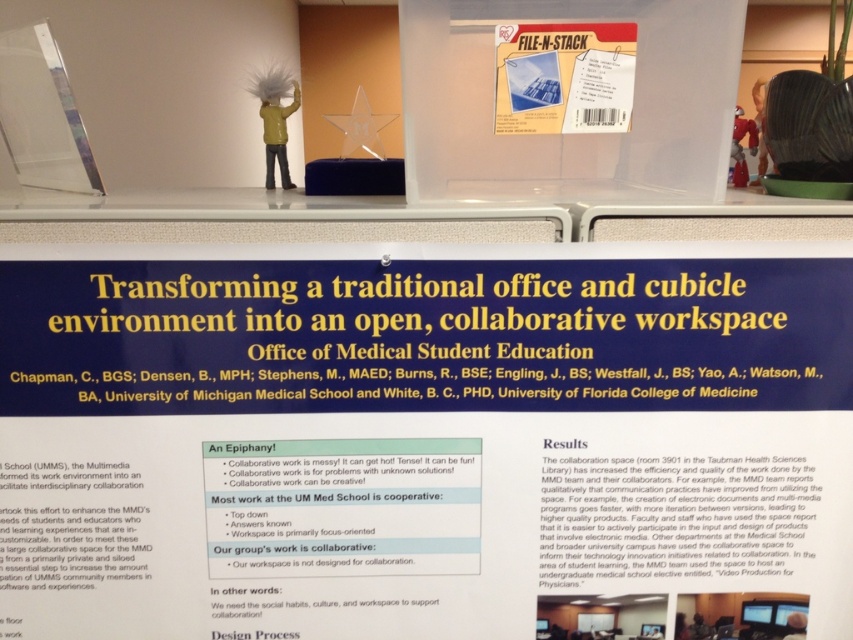
Can you confirm if transparent plastic container at center is shorter than matte plastic file folder at upper center?

No, transparent plastic container at center is not shorter than matte plastic file folder at upper center.

Can you confirm if transparent plastic container at center is smaller than matte plastic file folder at upper center?

No, transparent plastic container at center is not smaller than matte plastic file folder at upper center.

Which is in front, point (608, 186) or point (547, 74)?

Point (547, 74) is more forward.

Where is `transparent plastic container at center`? Image resolution: width=853 pixels, height=640 pixels. transparent plastic container at center is located at coordinates (569, 132).

From the picture: Is white paperboard at center thinner than transparent plastic container at center?

Incorrect, white paperboard at center's width is not less than transparent plastic container at center's.

Does white paperboard at center have a smaller size compared to transparent plastic container at center?

No, white paperboard at center is not smaller than transparent plastic container at center.

Does point (764, 506) come closer to viewer compared to point (726, 122)?

No, (764, 506) is further to viewer.

Find the location of `white paperboard at center`. white paperboard at center is located at coordinates (416, 438).

Between white paperboard at center and matte plastic file folder at upper center, which one appears on the right side from the viewer's perspective?

matte plastic file folder at upper center

The width and height of the screenshot is (853, 640). What do you see at coordinates (416, 438) in the screenshot?
I see `white paperboard at center` at bounding box center [416, 438].

Locate an element on the screen. The image size is (853, 640). white paperboard at center is located at coordinates (416, 438).